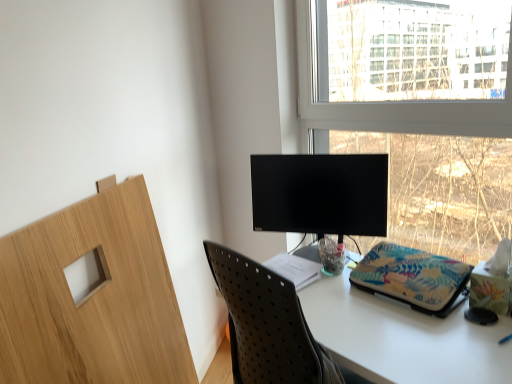
This screenshot has height=384, width=512. Describe the element at coordinates (403, 337) in the screenshot. I see `white matte table at center` at that location.

Find the location of a particular element. This screenshot has height=384, width=512. black matte monitor at center is located at coordinates (320, 194).

What do you see at coordinates (320, 194) in the screenshot? I see `black matte monitor at center` at bounding box center [320, 194].

Where is `white paper at center`? white paper at center is located at coordinates (x=295, y=269).

This screenshot has height=384, width=512. What are the coordinates of `floral fabric laptop sleeve at center` in the screenshot? It's located at (413, 278).

Measure the distance between floral fabric laptop sleeve at center and camera.

floral fabric laptop sleeve at center is 4.35 feet from camera.

Where is `transparent glass window at upper right`? transparent glass window at upper right is located at coordinates (417, 111).

Does white matte table at center turn towards transparent glass window at upper right?

No, white matte table at center does not turn towards transparent glass window at upper right.

This screenshot has width=512, height=384. What are the coordinates of `table in front of the transparent glass window at upper right` in the screenshot? It's located at (403, 337).

Are white matte table at center and transparent glass window at upper right located far from each other?

Yes, white matte table at center and transparent glass window at upper right are located far from each other.

From the image's perspective, does white matte table at center appear higher than transparent glass window at upper right?

No, from the image's perspective, white matte table at center is not over transparent glass window at upper right.

Does white paper at center touch floral fabric laptop sleeve at center?

No, white paper at center is not making contact with floral fabric laptop sleeve at center.

Is white paper at center oriented away from floral fabric laptop sleeve at center?

white paper at center does not have its back to floral fabric laptop sleeve at center.

From the image's perspective, which one is positioned higher, white paper at center or white matte table at center?

white paper at center, from the image's perspective.

Is white paper at center not within white matte table at center?

Yes, white paper at center is outside of white matte table at center.

How different are the orientations of white paper at center and white matte table at center in degrees?

0.404 degrees.

Looking at the image, does white paper at center seem bigger or smaller compared to white matte table at center?

In the image, white paper at center appears to be smaller than white matte table at center.

Can you confirm if transparent glass window at upper right is positioned to the right of white matte table at center?

Correct, you'll find transparent glass window at upper right to the right of white matte table at center.

Is transparent glass window at upper right looking in the opposite direction of white matte table at center?

No.

From a real-world perspective, does transparent glass window at upper right stand above white matte table at center?

Yes, from a real-world perspective, transparent glass window at upper right is over white matte table at center

Which of these two, transparent glass window at upper right or white matte table at center, stands taller?

transparent glass window at upper right is taller.

Is black matte monitor at center further to camera compared to white matte table at center?

Yes, the depth of black matte monitor at center is greater than that of white matte table at center.

Which of these two, black matte monitor at center or white matte table at center, stands shorter?

black matte monitor at center is shorter.

Does black matte monitor at center appear on the left side of white matte table at center?

Yes.

Can white matte table at center be found inside black matte monitor at center?

No, white matte table at center is located outside of black matte monitor at center.

Does transparent glass window at upper right come behind black matte monitor at center?

No, it is in front of black matte monitor at center.

Is transparent glass window at upper right placed right next to black matte monitor at center?

No, transparent glass window at upper right is not touching black matte monitor at center.

From the image's perspective, which object appears higher, transparent glass window at upper right or black matte monitor at center?

transparent glass window at upper right appears higher in the image.

Who is bigger, floral fabric laptop sleeve at center or white paper at center?

floral fabric laptop sleeve at center is bigger.

From a real-world perspective, is floral fabric laptop sleeve at center positioned under white paper at center based on gravity?

No.

Which point is more distant from viewer, (449, 296) or (282, 263)?

The point (282, 263) is farther.

Which object is more forward, floral fabric laptop sleeve at center or white paper at center?

floral fabric laptop sleeve at center is closer to the camera.

Find the location of a particular element. The image size is (512, 384). table beneath the transparent glass window at upper right (from a real-world perspective) is located at coordinates (403, 337).

Image resolution: width=512 pixels, height=384 pixels. Find the location of `stationery above the white paper at center (from a real-world perspective)`. stationery above the white paper at center (from a real-world perspective) is located at coordinates (413, 278).

When comparing their distances from white matte table at center, does transparent glass window at upper right or floral fabric laptop sleeve at center seem further?

transparent glass window at upper right.

Based on the photo, which object lies further to the anchor point transparent glass window at upper right, floral fabric laptop sleeve at center or white paper at center?

Among the two, white paper at center is located further to transparent glass window at upper right.

Estimate the real-world distances between objects in this image. Which object is further from black matte monitor at center, transparent glass window at upper right or white matte table at center?

transparent glass window at upper right is further to black matte monitor at center.

From the picture: When comparing their distances from black matte monitor at center, does white matte table at center or floral fabric laptop sleeve at center seem closer?

→ Among the two, floral fabric laptop sleeve at center is located nearer to black matte monitor at center.

Looking at the image, which one is located further to black matte monitor at center, white matte table at center or transparent glass window at upper right?

transparent glass window at upper right is further to black matte monitor at center.

Considering their positions, is white paper at center positioned further to floral fabric laptop sleeve at center than black matte monitor at center?

Based on the image, white paper at center appears to be further to floral fabric laptop sleeve at center.

From the image, which object appears to be farther from white paper at center, white matte table at center or floral fabric laptop sleeve at center?

floral fabric laptop sleeve at center is positioned further to the anchor white paper at center.

Based on their spatial positions, is floral fabric laptop sleeve at center or white matte table at center closer to white paper at center?

white matte table at center.

At what (x,y) coordinates should I click in order to perform the action: click on notebook between white matte table at center and black matte monitor at center from front to back. Please return your answer as a coordinate pair (x, y). The height and width of the screenshot is (384, 512). Looking at the image, I should click on (295, 269).

The height and width of the screenshot is (384, 512). Find the location of `computer monitor located between white paper at center and floral fabric laptop sleeve at center in the left-right direction`. computer monitor located between white paper at center and floral fabric laptop sleeve at center in the left-right direction is located at coordinates (320, 194).

This screenshot has height=384, width=512. In order to click on stationery that lies between transparent glass window at upper right and white paper at center from top to bottom in this screenshot , I will do `click(413, 278)`.

Identify the location of stationery between white matte table at center and black matte monitor at center along the z-axis. The height and width of the screenshot is (384, 512). (413, 278).